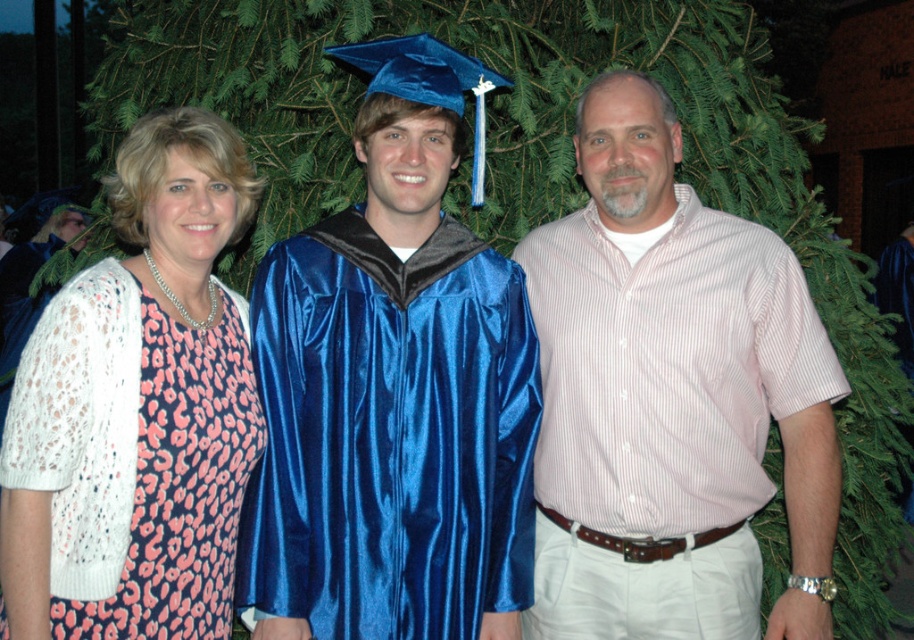
Question: Which object is farther from the camera taking this photo?

Choices:
 (A) pink striped shirt at center
 (B) pink leopard print dress at left

Answer: (A)

Question: Is shiny blue gown at center wider than pink leopard print dress at left?

Choices:
 (A) yes
 (B) no

Answer: (A)

Question: Estimate the real-world distances between objects in this image. Which object is farther from the pink striped shirt at center?

Choices:
 (A) pink leopard print dress at left
 (B) shiny blue gown at center

Answer: (A)

Question: Is shiny blue gown at center positioned before pink leopard print dress at left?

Choices:
 (A) yes
 (B) no

Answer: (B)

Question: Does pink striped shirt at center appear over pink leopard print dress at left?

Choices:
 (A) no
 (B) yes

Answer: (B)

Question: Which point is farther from the camera taking this photo?

Choices:
 (A) (x=25, y=416)
 (B) (x=266, y=556)
 (C) (x=615, y=131)

Answer: (C)